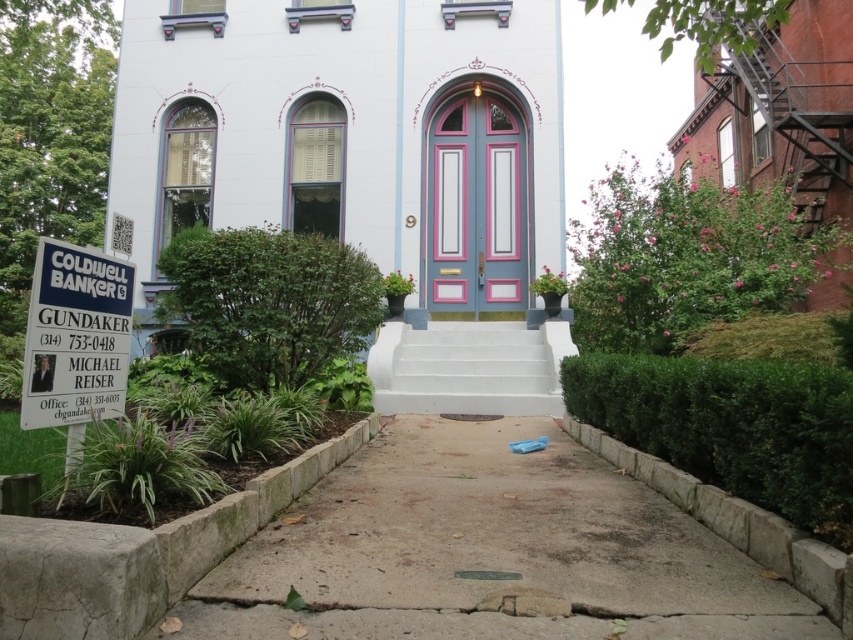
Question: In this image, where is rustic brick fire escape at right located relative to white plastic coldwell banker sign at left?

Choices:
 (A) left
 (B) right

Answer: (B)

Question: Which of the following is the closest to the observer?

Choices:
 (A) (379, 100)
 (B) (448, 369)
 (C) (422, 465)

Answer: (C)

Question: Which of the following is the closest to the observer?

Choices:
 (A) (691, 531)
 (B) (480, 330)
 (C) (354, 204)

Answer: (A)

Question: Can you confirm if gray concrete pavement at center is wider than white plastic coldwell banker sign at left?

Choices:
 (A) no
 (B) yes

Answer: (B)

Question: Which object is farther from the camera taking this photo?

Choices:
 (A) gray concrete pavement at center
 (B) matte white church at center
 (C) white concrete stairs at center

Answer: (C)

Question: Does matte white church at center have a larger size compared to rustic brick fire escape at right?

Choices:
 (A) yes
 (B) no

Answer: (A)